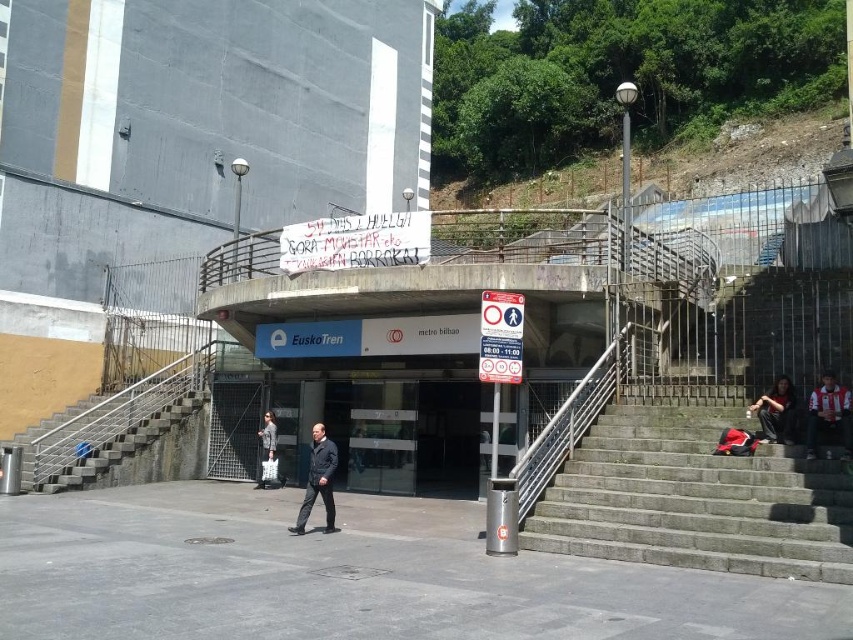
Question: Is white and red striped shirt at lower right positioned at the back of white cotton dress at center?

Choices:
 (A) yes
 (B) no

Answer: (B)

Question: Which object is the farthest from the gray concrete stairs at lower right?

Choices:
 (A) dark blue jeans at lower right
 (B) dark gray fabric jacket at center
 (C) white cotton dress at center
 (D) yellow concrete stairs at lower left

Answer: (D)

Question: Is yellow concrete stairs at lower left below dark gray fabric jacket at center?

Choices:
 (A) no
 (B) yes

Answer: (A)

Question: Is white and red striped shirt at lower right behind dark gray fabric jacket at center?

Choices:
 (A) yes
 (B) no

Answer: (B)

Question: Which point is farther from the camera taking this photo?

Choices:
 (A) (326, 484)
 (B) (630, 419)

Answer: (B)

Question: Among these objects, which one is farthest from the camera?

Choices:
 (A) dark blue jeans at lower right
 (B) dark gray fabric jacket at center
 (C) white cotton dress at center

Answer: (C)